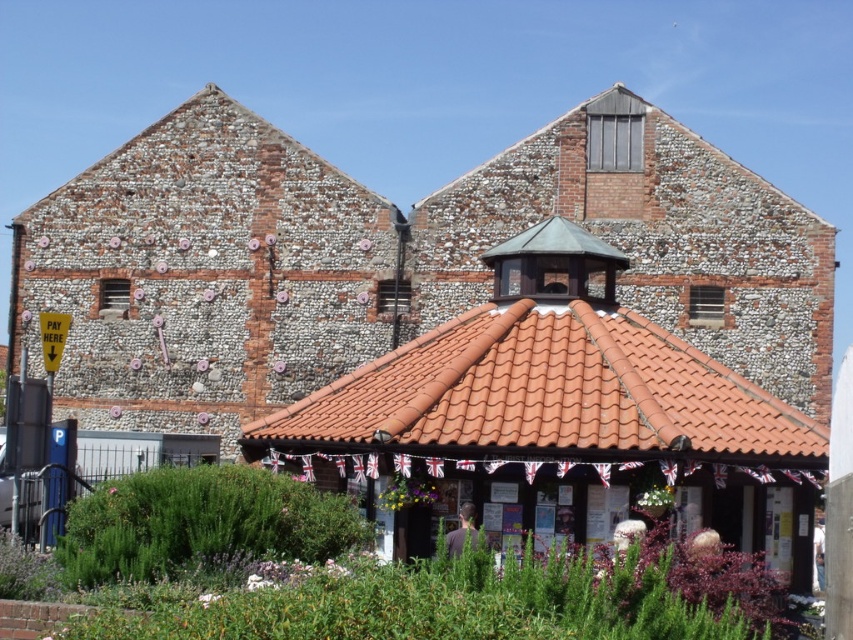
Question: Which of the following is the farthest from the observer?

Choices:
 (A) (x=347, y=433)
 (B) (x=263, y=426)

Answer: (B)

Question: Considering the relative positions of brown tiled gazebo at center and terracotta tiles at center in the image provided, where is brown tiled gazebo at center located with respect to terracotta tiles at center?

Choices:
 (A) below
 (B) above

Answer: (B)

Question: Can you confirm if brown tiled gazebo at center is wider than terracotta tiles at center?

Choices:
 (A) yes
 (B) no

Answer: (A)

Question: Where is brown tiled gazebo at center located in relation to terracotta tiles at center in the image?

Choices:
 (A) right
 (B) left

Answer: (A)

Question: Which object appears closest to the camera in this image?

Choices:
 (A) terracotta tiles at center
 (B) brown tiled gazebo at center

Answer: (A)